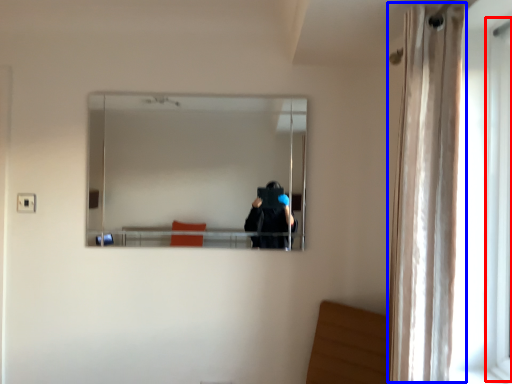
Question: Which object appears farthest to the camera in this image, screen door (highlighted by a red box) or curtain (highlighted by a blue box)?

Choices:
 (A) screen door
 (B) curtain

Answer: (A)